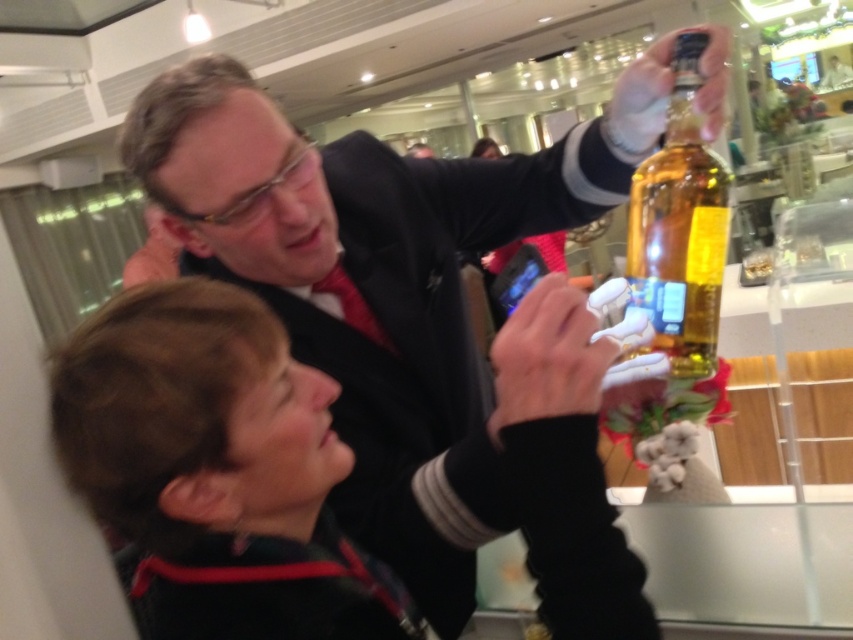
You are standing in the bar and want to locate the matte black jacket at upper center. What are the coordinates where you can find it?

The coordinates for the matte black jacket at upper center are 0.506 on the x axis and 0.496 on the y axis.